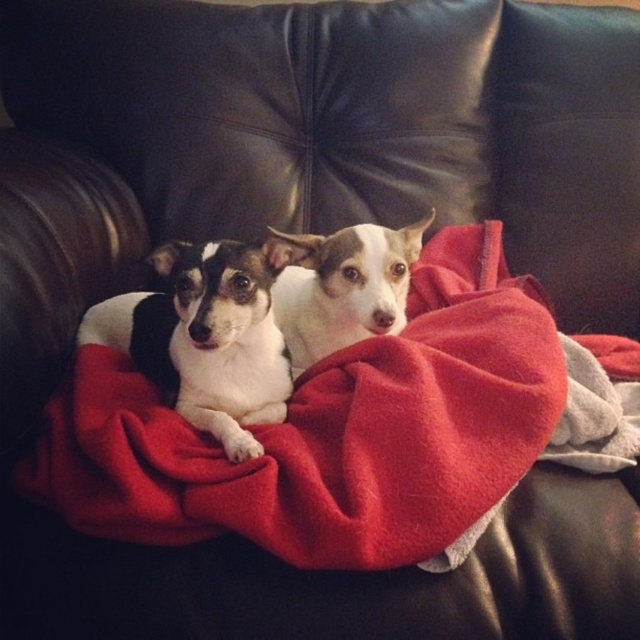
You are standing 1.5 meters away from a couch with a red blanket. There is a point at coordinates point (x=426, y=291) on the couch. Can you reach that point without moving closer to the couch?

The distance of point (x=426, y=291) from viewer is 1.24 meters. Since you are standing 1.5 meters away from the couch, the point is closer than your current position. You can reach it without moving closer.